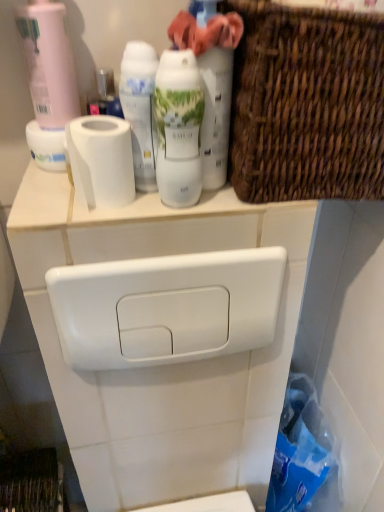
What do you see at coordinates (178, 128) in the screenshot?
I see `matte white shaving cream at center, arranged as the second shaving cream when viewed from the left` at bounding box center [178, 128].

The height and width of the screenshot is (512, 384). In order to click on woven brown basket at upper right in this screenshot , I will do `click(307, 104)`.

In order to face pink matte bottle at upper left, positioned as the first cleaning product in left-to-right order, should I rotate leftwards or rightwards?

You should rotate left by 18.365 degrees.

This screenshot has height=512, width=384. What do you see at coordinates (140, 108) in the screenshot?
I see `white glossy shaving cream at center, which appears as the 1th shaving cream when viewed from the left` at bounding box center [140, 108].

Where is `matte white spray can at upper center, placed as the second cleaning product when sorted from left to right`? matte white spray can at upper center, placed as the second cleaning product when sorted from left to right is located at coordinates (211, 78).

Looking at this image, from the image's perspective, which object appears higher, pink matte bottle at upper left, positioned as the first cleaning product in left-to-right order, or woven brown basket at upper right?

pink matte bottle at upper left, positioned as the first cleaning product in left-to-right order, from the image's perspective.

Based on their sizes in the image, would you say pink matte bottle at upper left, the 2th cleaning product positioned from the right, is bigger or smaller than woven brown basket at upper right?

Considering their sizes, pink matte bottle at upper left, the 2th cleaning product positioned from the right, takes up less space than woven brown basket at upper right.

Can you confirm if pink matte bottle at upper left, the 2th cleaning product positioned from the right, is wider than woven brown basket at upper right?

No.

Is pink matte bottle at upper left, the 2th cleaning product positioned from the right, inside the boundaries of woven brown basket at upper right, or outside?

pink matte bottle at upper left, the 2th cleaning product positioned from the right, is located beyond the bounds of woven brown basket at upper right.

Looking at this image, considering the sizes of objects white glossy shaving cream at center, arranged as the 2th shaving cream when viewed from the right, and pink matte bottle at upper left, positioned as the first cleaning product in left-to-right order, in the image provided, who is taller, white glossy shaving cream at center, arranged as the 2th shaving cream when viewed from the right, or pink matte bottle at upper left, positioned as the first cleaning product in left-to-right order,?

Standing taller between the two is pink matte bottle at upper left, positioned as the first cleaning product in left-to-right order.

Is white glossy shaving cream at center, which appears as the 1th shaving cream when viewed from the left, bigger than pink matte bottle at upper left, the 2th cleaning product positioned from the right?

No, white glossy shaving cream at center, which appears as the 1th shaving cream when viewed from the left, is not bigger than pink matte bottle at upper left, the 2th cleaning product positioned from the right.

Is white glossy shaving cream at center, which appears as the 1th shaving cream when viewed from the left, positioned with its back to pink matte bottle at upper left, the 2th cleaning product positioned from the right?

That's not correct — white glossy shaving cream at center, which appears as the 1th shaving cream when viewed from the left, is not looking away from pink matte bottle at upper left, the 2th cleaning product positioned from the right.

From the image's perspective, does white glossy shaving cream at center, which appears as the 1th shaving cream when viewed from the left, appear lower than pink matte bottle at upper left, the 2th cleaning product positioned from the right?

Yes, from the image's perspective, white glossy shaving cream at center, which appears as the 1th shaving cream when viewed from the left, is beneath pink matte bottle at upper left, the 2th cleaning product positioned from the right.

Is white glossy toilet tank at upper center inside or outside of white glossy shaving cream at center, which appears as the 1th shaving cream when viewed from the left?

white glossy toilet tank at upper center is located beyond the bounds of white glossy shaving cream at center, which appears as the 1th shaving cream when viewed from the left.

Where is `shaving cream that is the 2nd one when counting upward from the white glossy toilet tank at upper center (from the image's perspective)`? This screenshot has width=384, height=512. shaving cream that is the 2nd one when counting upward from the white glossy toilet tank at upper center (from the image's perspective) is located at coordinates click(x=140, y=108).

Is point (265, 490) less distant than point (143, 130)?

That is False.

Is white glossy toilet tank at upper center closer to the viewer compared to white glossy shaving cream at center, which appears as the 1th shaving cream when viewed from the left?

No.

Is point (280, 48) positioned in front of point (161, 97)?

That is True.

Considering the relative sizes of woven brown basket at upper right and matte white shaving cream at center, acting as the first shaving cream starting from the right, in the image provided, is woven brown basket at upper right smaller than matte white shaving cream at center, acting as the first shaving cream starting from the right,?

No, woven brown basket at upper right is not smaller than matte white shaving cream at center, acting as the first shaving cream starting from the right.

Is woven brown basket at upper right not close to matte white shaving cream at center, arranged as the second shaving cream when viewed from the left?

That's not correct — woven brown basket at upper right is a little close to matte white shaving cream at center, arranged as the second shaving cream when viewed from the left.

From a real-world perspective, does woven brown basket at upper right sit lower than matte white shaving cream at center, arranged as the second shaving cream when viewed from the left?

No, from a real-world perspective, woven brown basket at upper right is not under matte white shaving cream at center, arranged as the second shaving cream when viewed from the left.

Starting from the pink matte bottle at upper left, the 2th cleaning product positioned from the right, which shaving cream is the 2nd one to the right? Please provide its 2D coordinates.

[(178, 128)]

From a real-world perspective, which object rests below the other?

From a 3D spatial view, matte white shaving cream at center, arranged as the second shaving cream when viewed from the left, is below.

From the picture: From the image's perspective, is matte white shaving cream at center, acting as the first shaving cream starting from the right, on top of pink matte bottle at upper left, positioned as the first cleaning product in left-to-right order?

No, from the image's perspective, matte white shaving cream at center, acting as the first shaving cream starting from the right, is not over pink matte bottle at upper left, positioned as the first cleaning product in left-to-right order.

Considering the relative positions of matte white spray can at upper center, which is counted as the 1th cleaning product, starting from the right, and pink matte bottle at upper left, the 2th cleaning product positioned from the right, in the image provided, is matte white spray can at upper center, which is counted as the 1th cleaning product, starting from the right, to the right of pink matte bottle at upper left, the 2th cleaning product positioned from the right, from the viewer's perspective?

Correct, you'll find matte white spray can at upper center, which is counted as the 1th cleaning product, starting from the right, to the right of pink matte bottle at upper left, the 2th cleaning product positioned from the right.

Is the depth of matte white spray can at upper center, which is counted as the 1th cleaning product, starting from the right, greater than that of pink matte bottle at upper left, positioned as the first cleaning product in left-to-right order?

No.

Where is `cleaning product located on the left of matte white spray can at upper center, which is counted as the 1th cleaning product, starting from the right`? The image size is (384, 512). cleaning product located on the left of matte white spray can at upper center, which is counted as the 1th cleaning product, starting from the right is located at coordinates (48, 63).

How far apart are matte white spray can at upper center, placed as the second cleaning product when sorted from left to right, and pink matte bottle at upper left, positioned as the first cleaning product in left-to-right order?

A distance of 8.43 inches exists between matte white spray can at upper center, placed as the second cleaning product when sorted from left to right, and pink matte bottle at upper left, positioned as the first cleaning product in left-to-right order.

From the image's perspective, between matte white shaving cream at center, arranged as the second shaving cream when viewed from the left, and matte white spray can at upper center, which is counted as the 1th cleaning product, starting from the right, which one is located above?

matte white spray can at upper center, which is counted as the 1th cleaning product, starting from the right, appears higher in the image.

Can you tell me how much matte white shaving cream at center, arranged as the second shaving cream when viewed from the left, and matte white spray can at upper center, which is counted as the 1th cleaning product, starting from the right, differ in facing direction?

The facing directions of matte white shaving cream at center, arranged as the second shaving cream when viewed from the left, and matte white spray can at upper center, which is counted as the 1th cleaning product, starting from the right, are 0.000422 degrees apart.

Looking at this image, which point is more forward, (165, 161) or (209, 27)?

The point (209, 27) is in front.

Consider the image. Can you confirm if matte white shaving cream at center, acting as the first shaving cream starting from the right, is thinner than matte white spray can at upper center, which is counted as the 1th cleaning product, starting from the right?

Yes, matte white shaving cream at center, acting as the first shaving cream starting from the right, is thinner than matte white spray can at upper center, which is counted as the 1th cleaning product, starting from the right.

From the woven brown basket at upper right, count 2nd cleaning products backward and point to it. Please provide its 2D coordinates.

[(48, 63)]

I want to click on the 1st shaving cream in front when counting from the pink matte bottle at upper left, the 2th cleaning product positioned from the right, so click(140, 108).

From the image, which object appears to be nearer to woven brown basket at upper right, white glossy toilet tank at upper center or matte white shaving cream at center, arranged as the second shaving cream when viewed from the left?

matte white shaving cream at center, arranged as the second shaving cream when viewed from the left, lies closer to woven brown basket at upper right than the other object.

Based on their spatial positions, is white glossy shaving cream at center, which appears as the 1th shaving cream when viewed from the left, or matte white shaving cream at center, arranged as the second shaving cream when viewed from the left, closer to white matte toilet paper at upper left?

Among the two, white glossy shaving cream at center, which appears as the 1th shaving cream when viewed from the left, is located nearer to white matte toilet paper at upper left.

Looking at the image, which one is located further to matte white spray can at upper center, placed as the second cleaning product when sorted from left to right, white glossy shaving cream at center, which appears as the 1th shaving cream when viewed from the left, or white glossy toilet tank at upper center?

Based on the image, white glossy toilet tank at upper center appears to be further to matte white spray can at upper center, placed as the second cleaning product when sorted from left to right.

Estimate the real-world distances between objects in this image. Which object is further from matte white spray can at upper center, which is counted as the 1th cleaning product, starting from the right, white glossy toilet tank at upper center or white glossy shaving cream at center, arranged as the 2th shaving cream when viewed from the right?

white glossy toilet tank at upper center is positioned further to the anchor matte white spray can at upper center, which is counted as the 1th cleaning product, starting from the right.

Based on their spatial positions, is matte white shaving cream at center, acting as the first shaving cream starting from the right, or white glossy toilet tank at upper center further from woven brown basket at upper right?

white glossy toilet tank at upper center lies further to woven brown basket at upper right than the other object.

Based on their spatial positions, is white glossy toilet tank at upper center or white glossy shaving cream at center, which appears as the 1th shaving cream when viewed from the left, further from woven brown basket at upper right?

The object further to woven brown basket at upper right is white glossy toilet tank at upper center.

Based on their spatial positions, is woven brown basket at upper right or white glossy toilet tank at upper center closer to pink matte bottle at upper left, the 2th cleaning product positioned from the right?

Based on the image, woven brown basket at upper right appears to be nearer to pink matte bottle at upper left, the 2th cleaning product positioned from the right.

From the image, which object appears to be nearer to matte white spray can at upper center, placed as the second cleaning product when sorted from left to right, matte white shaving cream at center, arranged as the second shaving cream when viewed from the left, or white matte toilet paper at upper left?

Among the two, matte white shaving cream at center, arranged as the second shaving cream when viewed from the left, is located nearer to matte white spray can at upper center, placed as the second cleaning product when sorted from left to right.

The height and width of the screenshot is (512, 384). I want to click on toilet paper between matte white spray can at upper center, placed as the second cleaning product when sorted from left to right, and white glossy toilet tank at upper center vertically, so click(x=101, y=161).

Find the location of `shaving cream between white glossy shaving cream at center, arranged as the 2th shaving cream when viewed from the right, and woven brown basket at upper right, in the horizontal direction`. shaving cream between white glossy shaving cream at center, arranged as the 2th shaving cream when viewed from the right, and woven brown basket at upper right, in the horizontal direction is located at coordinates (178, 128).

Locate an element on the screen. This screenshot has width=384, height=512. cleaning product between pink matte bottle at upper left, positioned as the first cleaning product in left-to-right order, and woven brown basket at upper right from left to right is located at coordinates (211, 78).

You are a GUI agent. You are given a task and a screenshot of the screen. Output one action in this format:
    pyautogui.click(x=<x>, y=<y>)
    Task: Click on the cleaning product between woven brown basket at upper right and white glossy toilet tank at upper center in the vertical direction
    
    Given the screenshot: What is the action you would take?
    pyautogui.click(x=211, y=78)